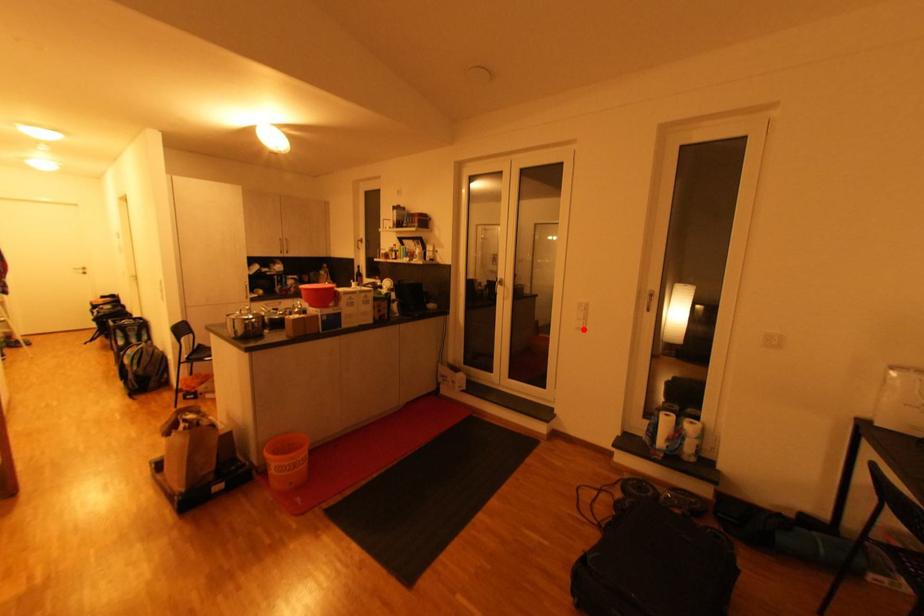
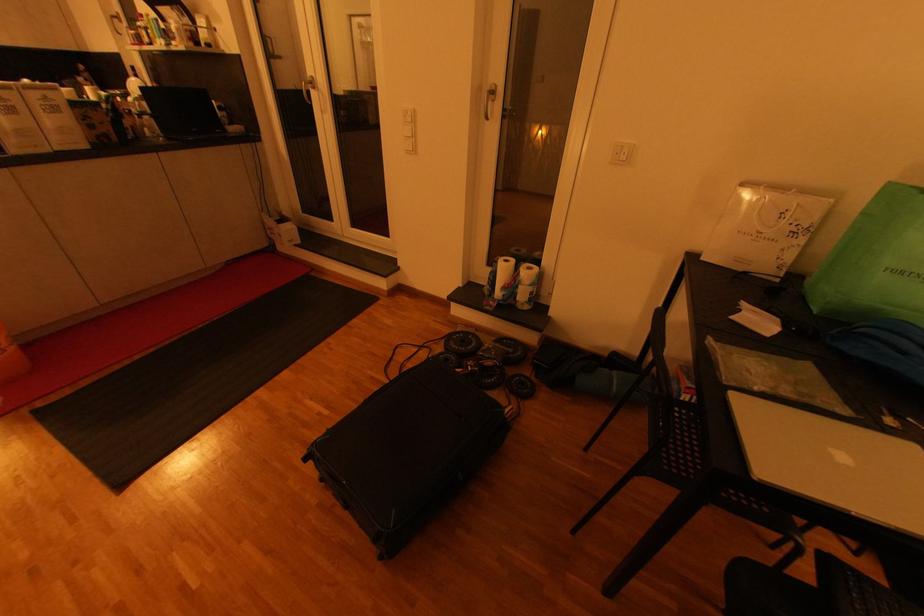
Locate, in the second image, the point that corresponds to the highlighted location in the first image.

(412, 153)